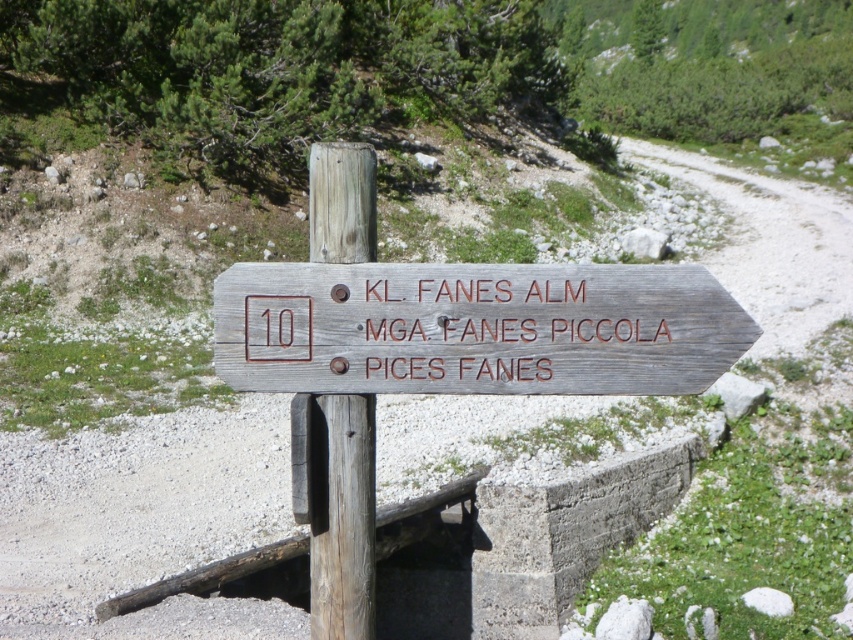
Question: Is weathered wood sign at center to the left of weathered wood signpost at center from the viewer's perspective?

Choices:
 (A) no
 (B) yes

Answer: (A)

Question: Which point is closer to the camera?

Choices:
 (A) (310, 243)
 (B) (245, 307)

Answer: (B)

Question: Does weathered wood sign at center have a larger size compared to weathered wood signpost at center?

Choices:
 (A) yes
 (B) no

Answer: (A)

Question: Observing the image, what is the correct spatial positioning of weathered wood sign at center in reference to weathered wood signpost at center?

Choices:
 (A) below
 (B) above

Answer: (B)